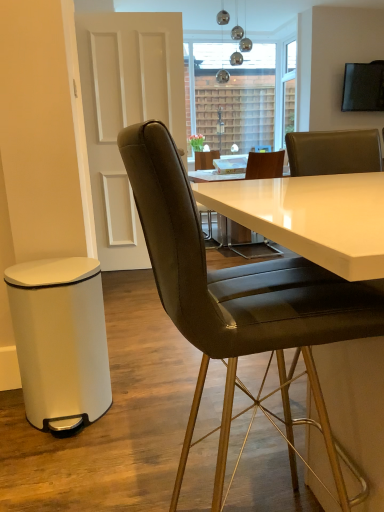
Image resolution: width=384 pixels, height=512 pixels. What do you see at coordinates (241, 94) in the screenshot?
I see `transparent glass window at upper center` at bounding box center [241, 94].

What do you see at coordinates (236, 294) in the screenshot?
I see `leather/goldenchair at center` at bounding box center [236, 294].

Find the location of a particular element. transparent glass window at upper center is located at coordinates (241, 94).

Considering the relative sizes of transparent glass window at upper center and white matte bar stool at lower left in the image provided, is transparent glass window at upper center smaller than white matte bar stool at lower left?

Yes, transparent glass window at upper center is smaller than white matte bar stool at lower left.

How many degrees apart are the facing directions of transparent glass window at upper center and white matte bar stool at lower left?

They differ by 0.121 degrees in their facing directions.

Considering the positions of objects transparent glass window at upper center and white matte bar stool at lower left in the image provided, who is in front, transparent glass window at upper center or white matte bar stool at lower left?

white matte bar stool at lower left.

Which object is closer to the camera taking this photo, leather/goldenchair at center or white matte bar stool at lower left?

leather/goldenchair at center is closer to the camera.

Considering the points (218, 509) and (35, 349), which point is in front, point (218, 509) or point (35, 349)?

The point (218, 509) is closer to the camera.

In order to click on bar stool behind the leather/goldenchair at center in this screenshot , I will do click(x=60, y=341).

In the image, is leather/goldenchair at center on the left side or the right side of white glossy door at upper left?

Based on their positions, leather/goldenchair at center is located to the right of white glossy door at upper left.

Is leather/goldenchair at center oriented towards white glossy door at upper left?

No, leather/goldenchair at center is not oriented towards white glossy door at upper left.

In the image, is leather/goldenchair at center positioned in front of or behind white glossy door at upper left?

→ Visually, leather/goldenchair at center is located in front of white glossy door at upper left.

Between point (273, 123) and point (223, 357), which one is positioned in front?

The point (223, 357) is more forward.

Does transparent glass window at upper center appear on the right side of leather/goldenchair at center?

Indeed, transparent glass window at upper center is positioned on the right side of leather/goldenchair at center.

From a real-world perspective, between transparent glass window at upper center and leather/goldenchair at center, who is vertically lower?

leather/goldenchair at center is physically lower.

Is transparent glass window at upper center not near leather/goldenchair at center?

Yes.

Would you say white glossy door at upper left is outside transparent glass window at upper center?

Yes.

Is white glossy door at upper left positioned with its back to transparent glass window at upper center?

No.

Considering the sizes of objects white glossy door at upper left and transparent glass window at upper center in the image provided, who is thinner, white glossy door at upper left or transparent glass window at upper center?

transparent glass window at upper center is thinner.

Which is closer, (113, 57) or (295, 75)?

Point (113, 57) is closer to the camera than point (295, 75).

Which is more to the right, transparent glass window at upper center or white glossy door at upper left?

Positioned to the right is transparent glass window at upper center.

Is transparent glass window at upper center touching white glossy door at upper left?

They are not placed beside each other.

Does point (224, 57) come in front of point (94, 216)?

No, it is not.

Is white glossy door at upper left completely or partially inside transparent glass window at upper center?

No, transparent glass window at upper center does not contain white glossy door at upper left.

How distant is white matte bar stool at lower left from transparent glass window at upper center?

white matte bar stool at lower left and transparent glass window at upper center are 5.03 meters apart from each other.

Which of these two, white matte bar stool at lower left or transparent glass window at upper center, is thinner?

transparent glass window at upper center.

Is white matte bar stool at lower left outside of transparent glass window at upper center?

white matte bar stool at lower left lies outside transparent glass window at upper center's area.

From a real-world perspective, which object stands above the other?

transparent glass window at upper center.

The image size is (384, 512). Find the location of `bar stool to the left of transparent glass window at upper center`. bar stool to the left of transparent glass window at upper center is located at coordinates (60, 341).

Locate an element on the screen. This screenshot has height=512, width=384. chair above the white matte bar stool at lower left (from a real-world perspective) is located at coordinates (236, 294).

Looking at this image, when comparing their distances from leather/goldenchair at center, does white matte bar stool at lower left or transparent glass window at upper center seem further?

transparent glass window at upper center is further to leather/goldenchair at center.

Based on their spatial positions, is white matte bar stool at lower left or transparent glass window at upper center closer to white glossy door at upper left?

The object closer to white glossy door at upper left is white matte bar stool at lower left.

Consider the image. Based on their spatial positions, is white glossy door at upper left or white matte bar stool at lower left closer to transparent glass window at upper center?

white glossy door at upper left.

From the image, which object appears to be farther from white matte bar stool at lower left, white glossy door at upper left or transparent glass window at upper center?

Among the two, transparent glass window at upper center is located further to white matte bar stool at lower left.

Estimate the real-world distances between objects in this image. Which object is closer to white glossy door at upper left, transparent glass window at upper center or leather/goldenchair at center?

The object closer to white glossy door at upper left is transparent glass window at upper center.

From the image, which object appears to be farther from white matte bar stool at lower left, white glossy door at upper left or leather/goldenchair at center?

white glossy door at upper left lies further to white matte bar stool at lower left than the other object.

Which object lies nearer to the anchor point leather/goldenchair at center, white glossy door at upper left or white matte bar stool at lower left?

Based on the image, white matte bar stool at lower left appears to be nearer to leather/goldenchair at center.

Estimate the real-world distances between objects in this image. Which object is closer to white glossy door at upper left, transparent glass window at upper center or white matte bar stool at lower left?

white matte bar stool at lower left is positioned closer to the anchor white glossy door at upper left.

In order to click on glass door between white matte bar stool at lower left and transparent glass window at upper center from front to back in this screenshot , I will do `click(126, 114)`.

Find the location of `bar stool between leather/goldenchair at center and transparent glass window at upper center in the front-back direction`. bar stool between leather/goldenchair at center and transparent glass window at upper center in the front-back direction is located at coordinates (60, 341).

Locate an element on the screen. This screenshot has width=384, height=512. bar stool between leather/goldenchair at center and white glossy door at upper left along the z-axis is located at coordinates (60, 341).

You are a GUI agent. You are given a task and a screenshot of the screen. Output one action in this format:
    pyautogui.click(x=<x>, y=<y>)
    Task: Click on the glass door positioned between leather/goldenchair at center and transparent glass window at upper center from near to far
    The image size is (384, 512).
    Given the screenshot: What is the action you would take?
    pyautogui.click(x=126, y=114)